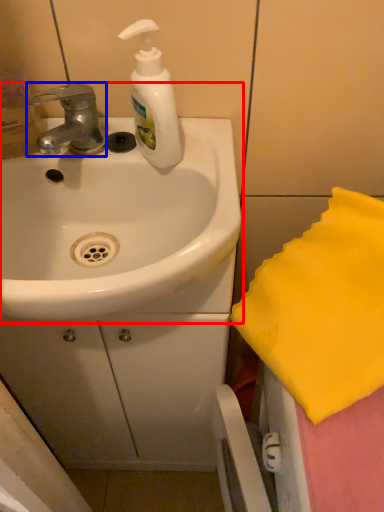
Question: Among these objects, which one is farthest to the camera, sink (highlighted by a red box) or tap (highlighted by a blue box)?

Choices:
 (A) sink
 (B) tap

Answer: (B)